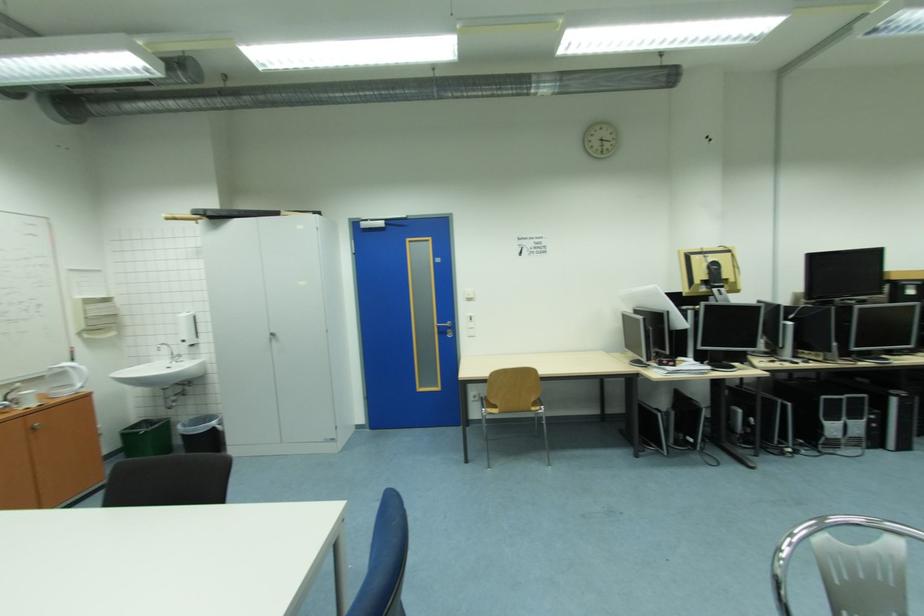
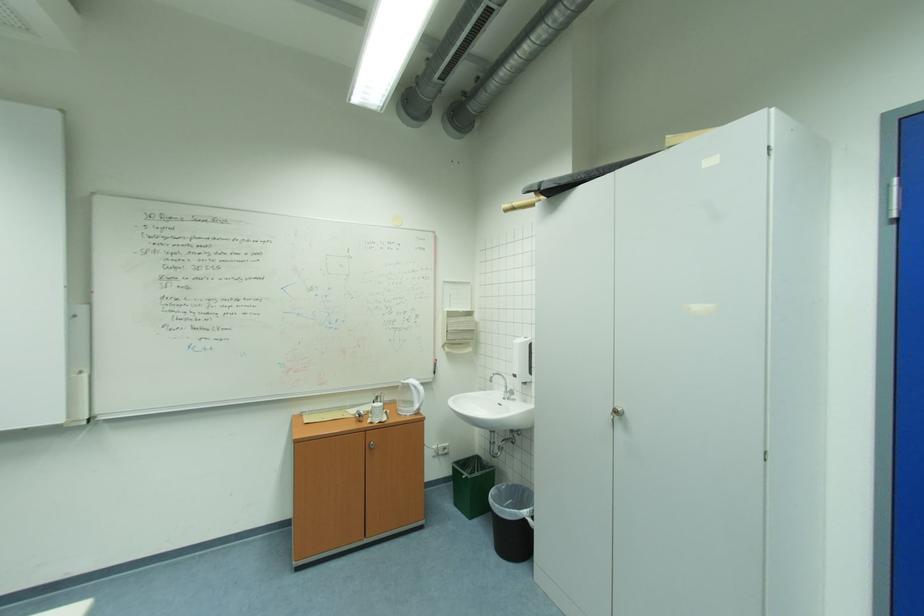
In the second image, find the point that corresponds to point 232,215 in the first image.

(569, 182)